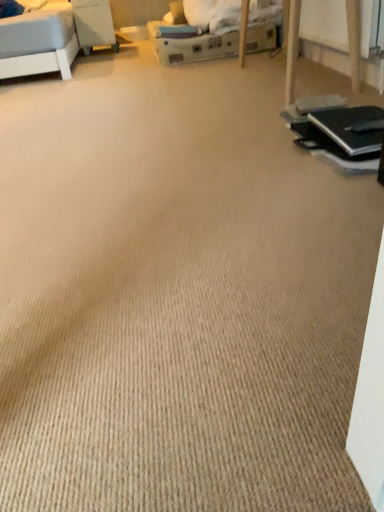
Question: Considering the positions of point (372, 138) and point (92, 15), is point (372, 138) closer or farther from the camera than point (92, 15)?

Choices:
 (A) closer
 (B) farther

Answer: (A)

Question: Is black matte laptop at right to the left or to the right of wooden table at upper left in the image?

Choices:
 (A) left
 (B) right

Answer: (B)

Question: Is black matte laptop at right spatially inside wooden table at upper left, or outside of it?

Choices:
 (A) inside
 (B) outside

Answer: (B)

Question: Is wooden table at upper left in front of or behind black matte laptop at right in the image?

Choices:
 (A) behind
 (B) front

Answer: (A)

Question: Looking at their shapes, would you say wooden table at upper left is wider or thinner than black matte laptop at right?

Choices:
 (A) wide
 (B) thin

Answer: (A)

Question: Which is correct: wooden table at upper left is inside black matte laptop at right, or outside of it?

Choices:
 (A) outside
 (B) inside

Answer: (A)

Question: In terms of size, does wooden table at upper left appear bigger or smaller than black matte laptop at right?

Choices:
 (A) big
 (B) small

Answer: (A)